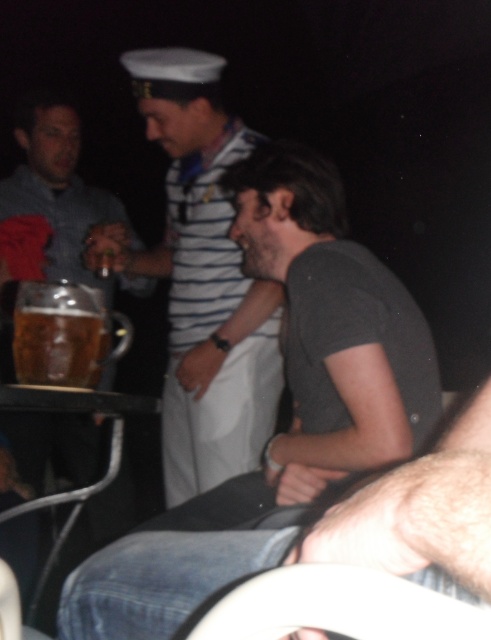
You are at a bar and see the striped sailor shirt at center and the translucent glass mug at center. Which object is closer to your right side?

The striped sailor shirt at center is to the right of the translucent glass mug at center, so the striped sailor shirt at center is closer to your right side.

You are at a bar and need to place a coaster under the translucent glass mug at center to prevent damage to the striped sailor shirt at center. Given that the coaster is 10 cm in diameter, will it sufficiently cover the area where the mug will be placed on the shirt?

The striped sailor shirt at center has a larger size compared to the translucent glass mug at center. Since the coaster is 10 cm in diameter, it should be sufficient to cover the base of the mug and protect the shirt from any drips or condensation.